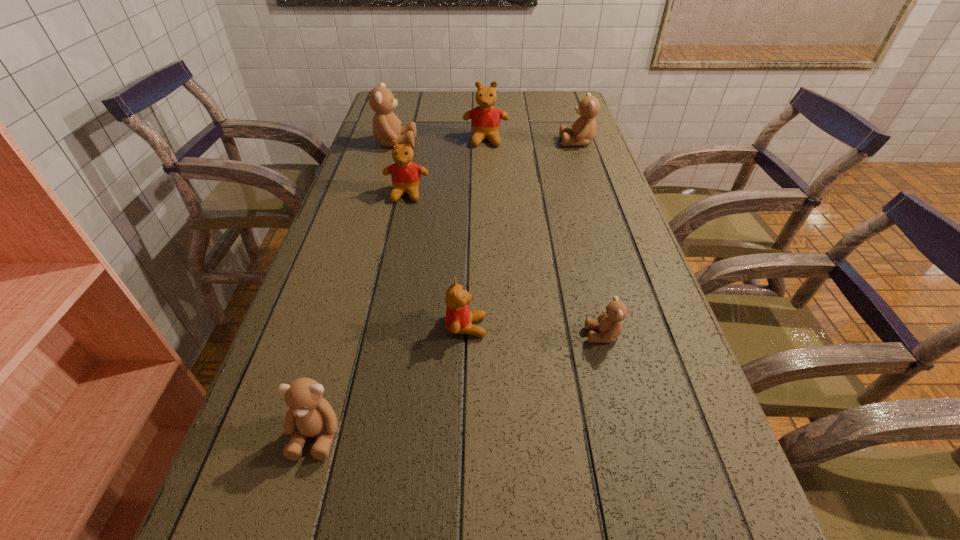
This screenshot has width=960, height=540. I want to click on vacant space located on the front-facing side of the second nearest brown teddy bear, so click(530, 335).

Locate an element on the screen. vacant space at the far edge is located at coordinates (505, 104).

Find the location of a particular element. The image size is (960, 540). free space at the left edge of the desktop is located at coordinates (233, 487).

This screenshot has width=960, height=540. In the image, there is a desktop. What are the coordinates of `vacant space at the right edge` in the screenshot? It's located at pos(600,164).

This screenshot has width=960, height=540. In the image, there is a desktop. Find the location of `vacant space at the far left corner`. vacant space at the far left corner is located at coordinates (397, 94).

Locate an element on the screen. The image size is (960, 540). vacant space at the far right corner of the desktop is located at coordinates (564, 106).

Locate an element on the screen. vacant area that lies between the farthest red teddy bear and the shortest object is located at coordinates (544, 238).

In order to click on vacant space that is in between the fourth farthest object and the farthest red teddy bear in this screenshot , I will do `click(446, 167)`.

Where is `empty space between the biggest red teddy bear and the second biggest brown teddy bear`? The height and width of the screenshot is (540, 960). empty space between the biggest red teddy bear and the second biggest brown teddy bear is located at coordinates (532, 141).

Locate an element on the screen. This screenshot has height=540, width=960. empty space between the biggest brown teddy bear and the second biggest brown teddy bear is located at coordinates (486, 143).